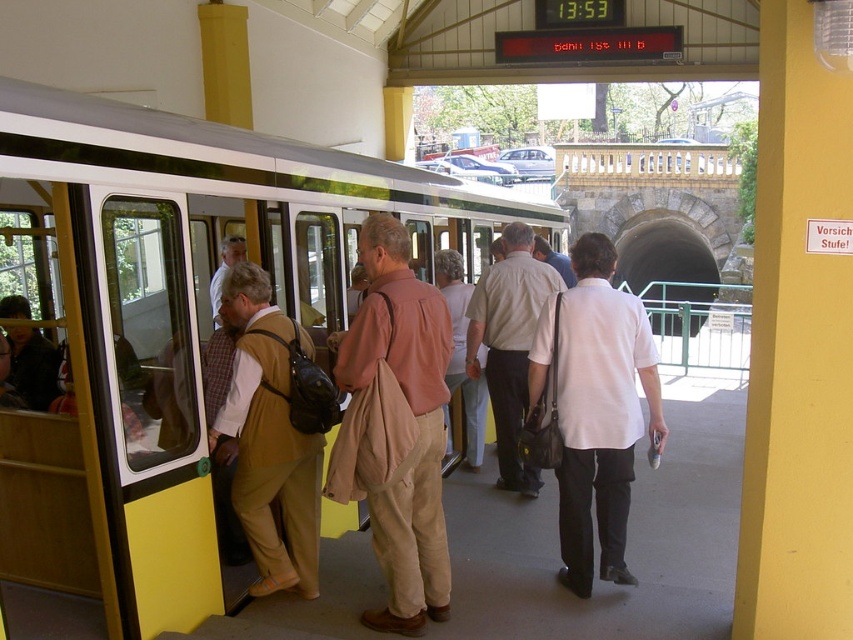
Question: Does beige fabric bag at center have a lesser width compared to khaki fabric vest at center?

Choices:
 (A) yes
 (B) no

Answer: (A)

Question: Does beige fabric bag at center appear on the right side of khaki fabric vest at center?

Choices:
 (A) yes
 (B) no

Answer: (A)

Question: Does yellow matte train at center appear under khaki fabric vest at center?

Choices:
 (A) yes
 (B) no

Answer: (B)

Question: Which point is farther to the camera?

Choices:
 (A) (495, 308)
 (B) (178, 276)
 (C) (427, 339)

Answer: (A)

Question: Which point appears farthest from the camera in this image?

Choices:
 (A) (543, 276)
 (B) (598, 291)

Answer: (A)

Question: Which object appears closest to the camera in this image?

Choices:
 (A) yellow matte train at center
 (B) khaki fabric vest at center
 (C) white smooth shirt at center
 (D) light beige fabric coat at center

Answer: (A)